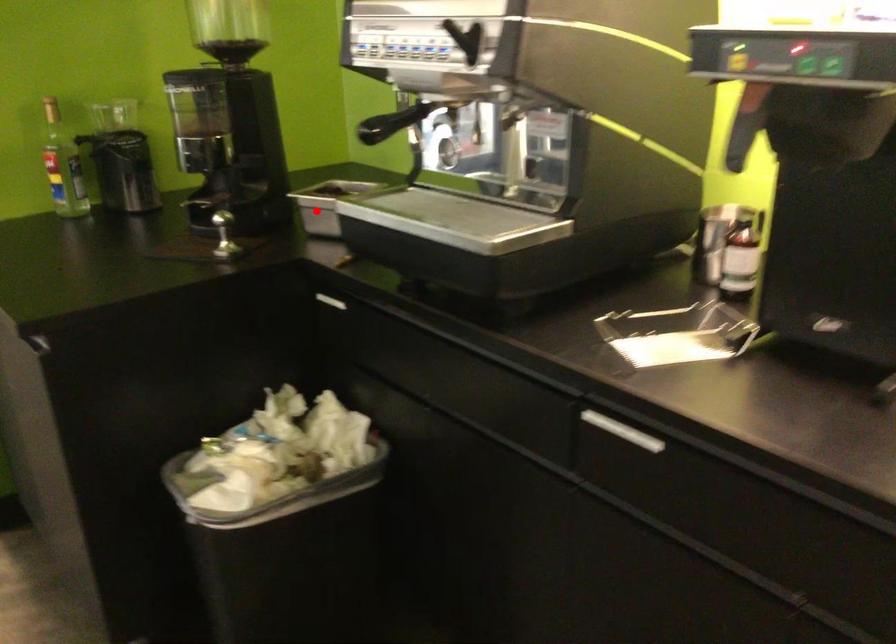
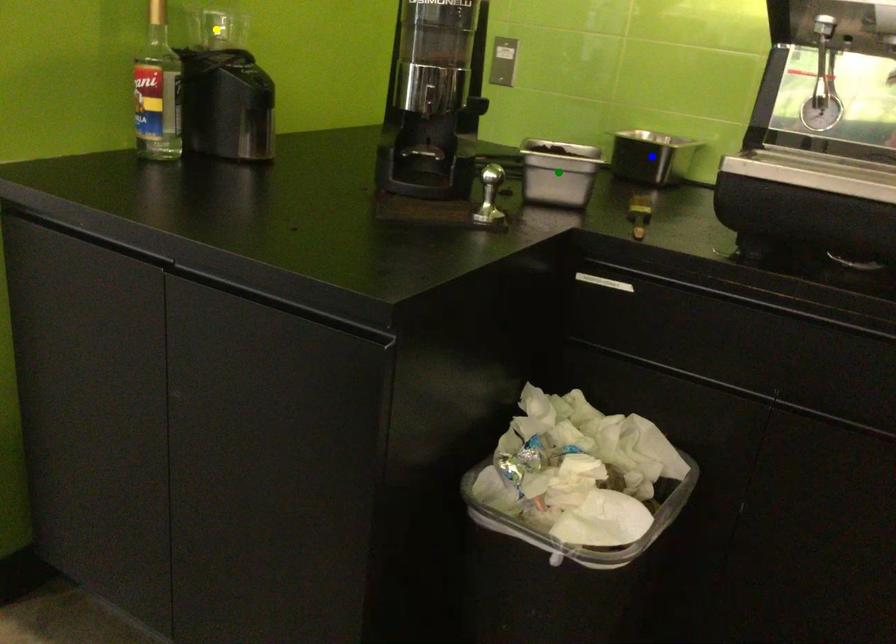
Question: I am providing you with two images of the same scene from different viewpoints. A red point is marked on the first image. You are given multiple points on the second image. Which point in image 2 is actually the same real-world point as the red point in image 1?

Choices:
 (A) yellow point
 (B) blue point
 (C) green point

Answer: (C)